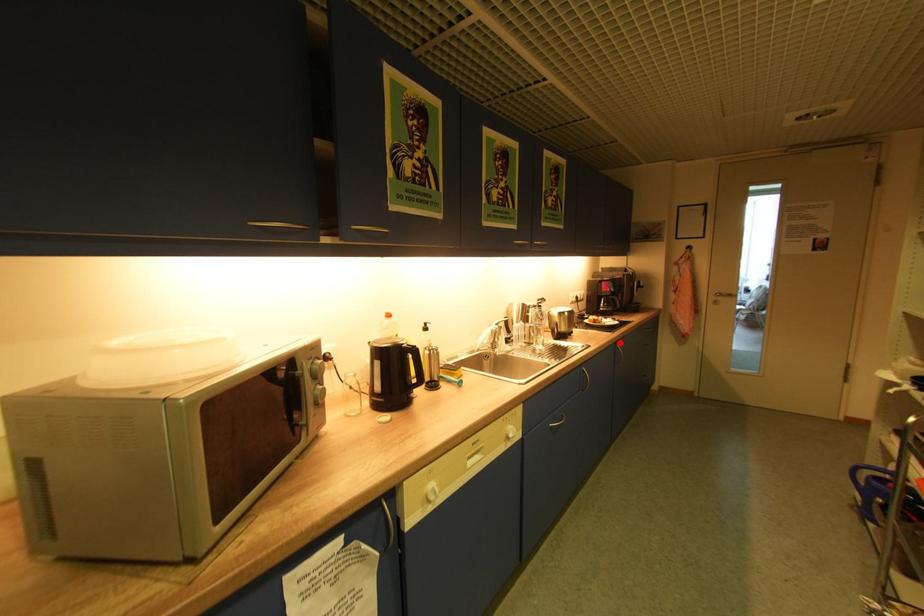
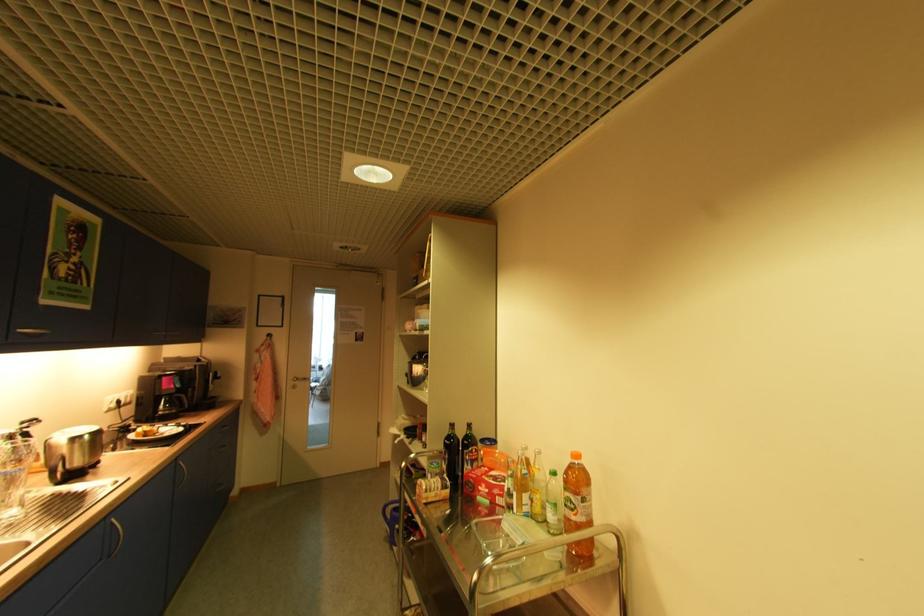
Question: I am providing you with two images of the same scene from different viewpoints. Given a red point in image1, look at the same physical point in image2. Is it:

Choices:
 (A) Closer to the viewpoint
 (B) Farther from the viewpoint

Answer: (A)